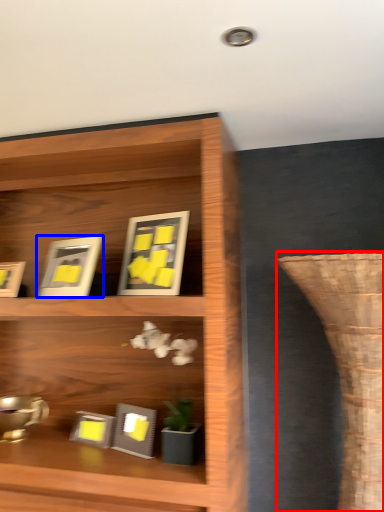
Question: Among these objects, which one is farthest to the camera, vase (highlighted by a red box) or picture frame (highlighted by a blue box)?

Choices:
 (A) vase
 (B) picture frame

Answer: (B)